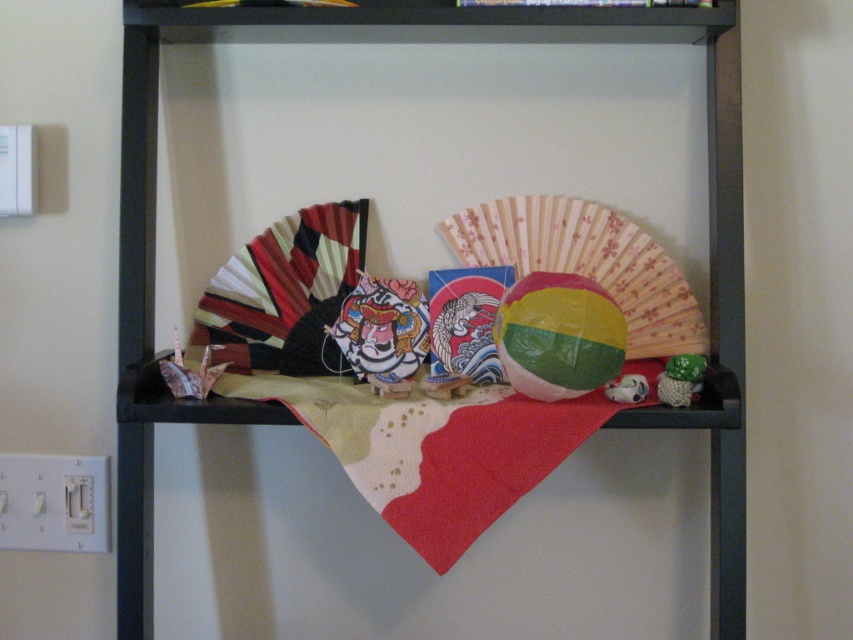
Is matte paper fan at center taller than glossy paper mask at center?

Incorrect, matte paper fan at center's height is not larger of glossy paper mask at center's.

What do you see at coordinates (558, 336) in the screenshot? This screenshot has height=640, width=853. I see `matte paper fan at center` at bounding box center [558, 336].

Between point (614, 307) and point (401, 358), which one is positioned behind?

The point (401, 358) is more distant.

You are a GUI agent. You are given a task and a screenshot of the screen. Output one action in this format:
    pyautogui.click(x=<x>, y=<y>)
    Task: Click on the matte paper fan at center
    
    Given the screenshot: What is the action you would take?
    pyautogui.click(x=558, y=336)

Which is behind, point (724, 413) or point (608, 324)?

The point (608, 324) is behind.

Who is lower down, wooden shelf at center or matte paper fan at center?

matte paper fan at center is lower down.

Is point (685, 13) farther from camera compared to point (567, 339)?

Yes, it is behind point (567, 339).

This screenshot has height=640, width=853. I want to click on wooden shelf at center, so click(288, 410).

Measure the distance between point (518, 388) and camera.

Point (518, 388) is 34.38 inches from camera.

Who is taller, matte paper fan at center or green knitted toy at right?

With more height is matte paper fan at center.

At what (x,y) coordinates should I click in order to perform the action: click on matte paper fan at center. Please return your answer as a coordinate pair (x, y). This screenshot has height=640, width=853. Looking at the image, I should click on (558, 336).

In order to click on matte paper fan at center in this screenshot , I will do `click(558, 336)`.